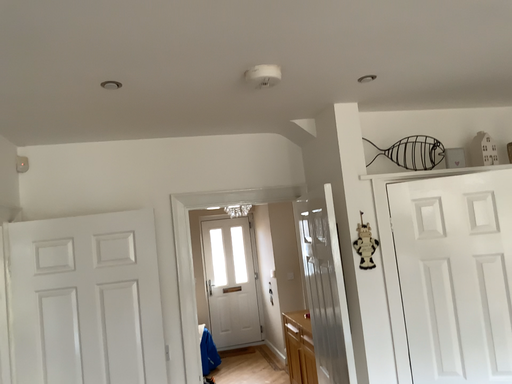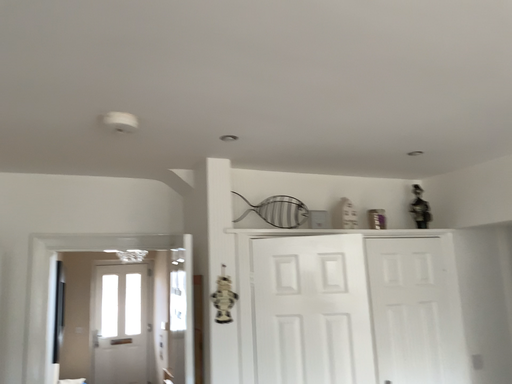
Question: Which way did the camera rotate in the video?

Choices:
 (A) rotated upward
 (B) rotated downward

Answer: (A)